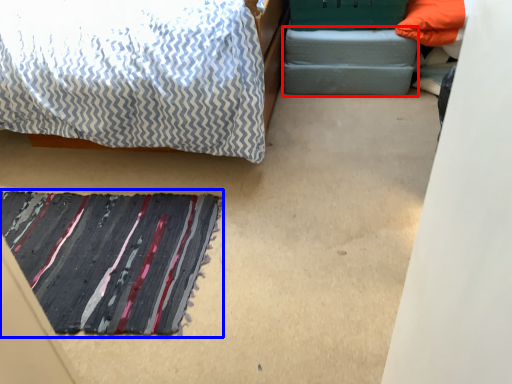
Question: Among these objects, which one is nearest to the camera, footrest (highlighted by a red box) or mat (highlighted by a blue box)?

Choices:
 (A) footrest
 (B) mat

Answer: (B)